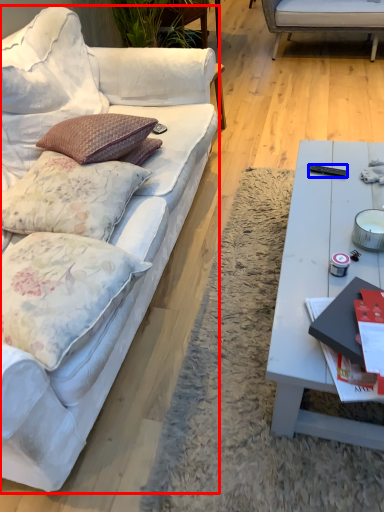
Question: Which of the following is the farthest to the observer, studio couch (highlighted by a red box) or remote control (highlighted by a blue box)?

Choices:
 (A) studio couch
 (B) remote control

Answer: (B)